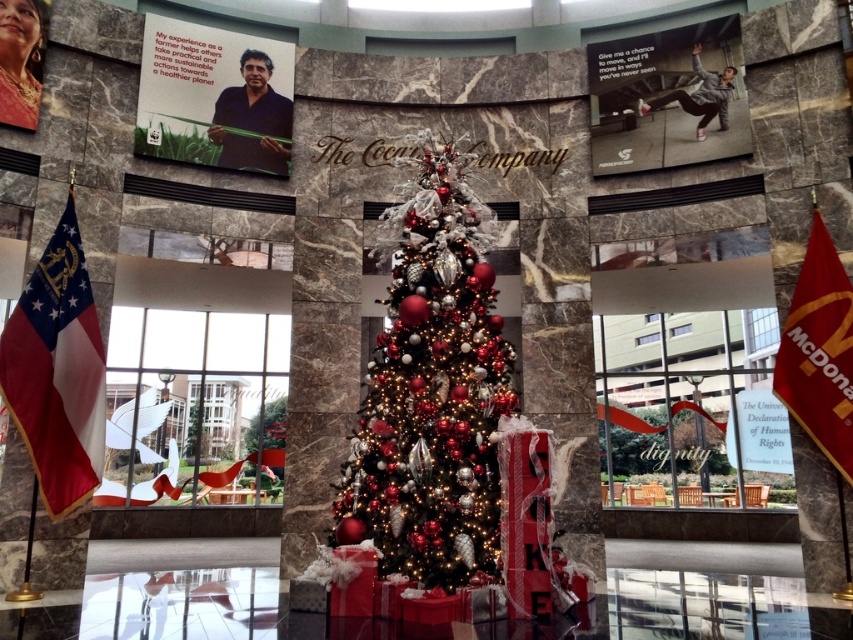
Does point (41, 404) come in front of point (795, 344)?

That is True.

Between point (27, 321) and point (801, 385), which one is positioned behind?

The point (801, 385) is more distant.

Who is more distant from viewer, (61, 432) or (813, 248)?

Point (813, 248)

Identify the location of red-white flag at left. Image resolution: width=853 pixels, height=640 pixels. point(57,371).

Is shiny metallic christmas tree at center thinner than red fabric flag at right?

Incorrect, shiny metallic christmas tree at center's width is not less than red fabric flag at right's.

Who is lower down, shiny metallic christmas tree at center or red fabric flag at right?

red fabric flag at right is lower down.

Is point (410, 454) closer to viewer compared to point (788, 365)?

Yes, it is.

Where is `shiny metallic christmas tree at center`? This screenshot has height=640, width=853. shiny metallic christmas tree at center is located at coordinates (432, 390).

Is shiny metallic christmas tree at center shorter than red-white flag at left?

In fact, shiny metallic christmas tree at center may be taller than red-white flag at left.

Does point (445, 520) lie behind point (44, 323)?

No.

Where is `shiny metallic christmas tree at center`? The image size is (853, 640). shiny metallic christmas tree at center is located at coordinates (432, 390).